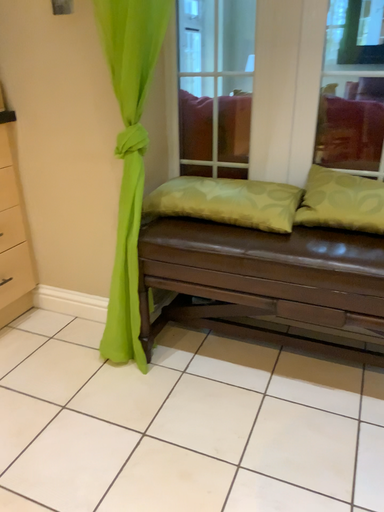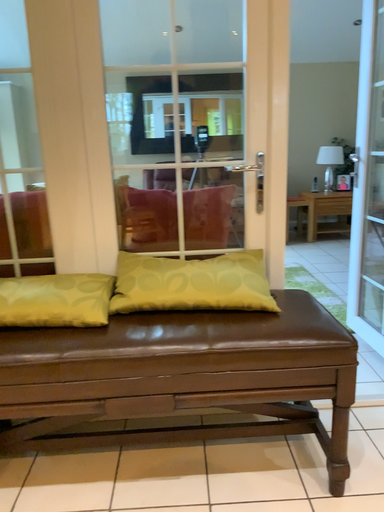
Question: How did the camera likely rotate when shooting the video?

Choices:
 (A) rotated downward
 (B) rotated upward

Answer: (B)